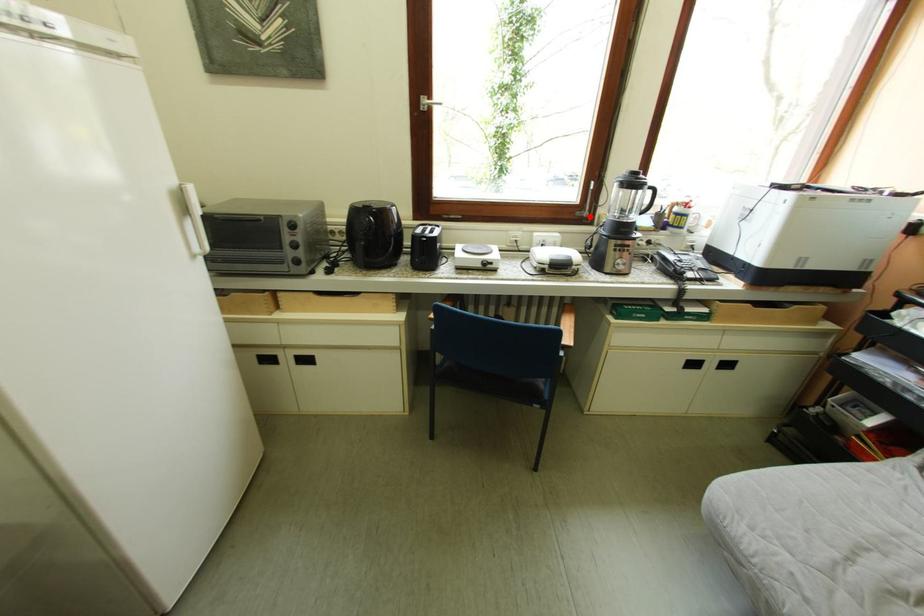
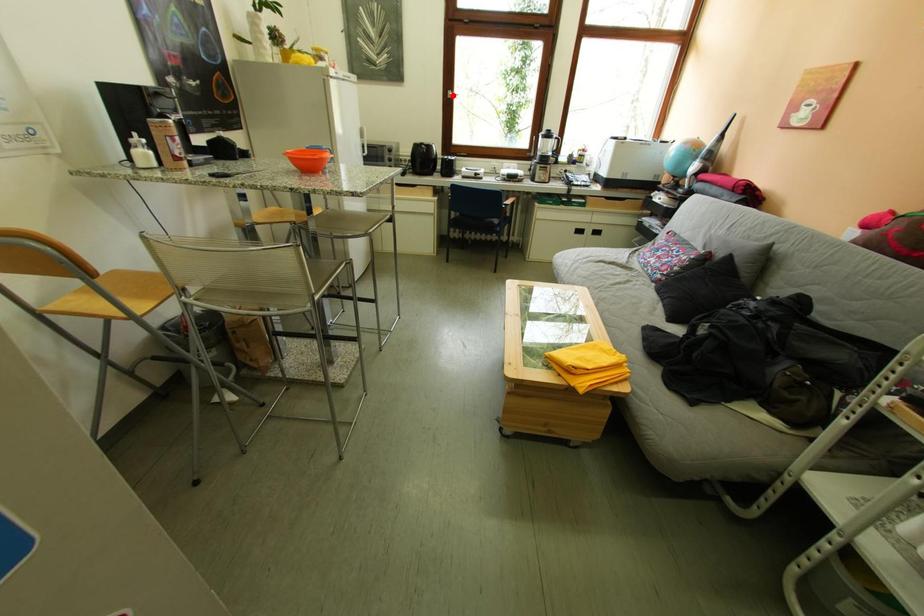
I am providing you with two images of the same scene from different viewpoints. A red point is marked on the first image and another point is marked on the second image. Do the highlighted points in image1 and image2 indicate the same real-world spot?

No